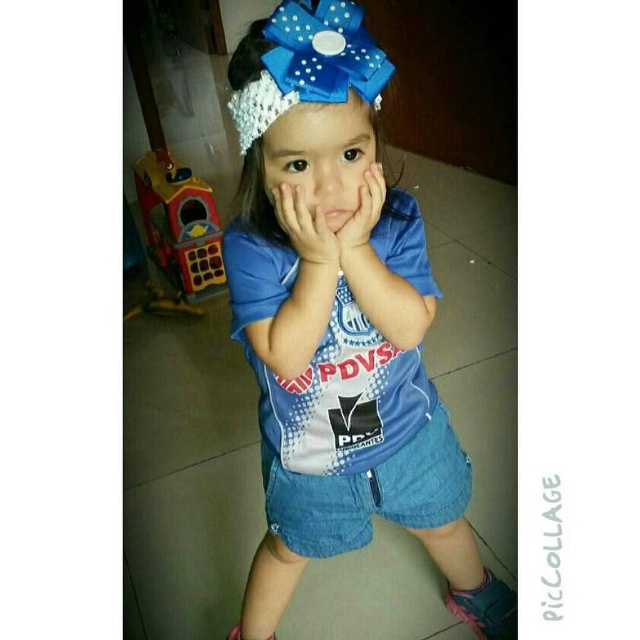
Question: Estimate the real-world distances between objects in this image. Which object is farther from the matte blue bow at center?

Choices:
 (A) matte plastic toy at left
 (B) matte blue hands at center
 (C) matte blue hand at center

Answer: (A)

Question: Does denim shorts at center lie behind matte blue hands at center?

Choices:
 (A) no
 (B) yes

Answer: (B)

Question: Can you confirm if matte blue bow at center is wider than matte blue hand at center?

Choices:
 (A) yes
 (B) no

Answer: (A)

Question: Which point is closer to the camera?

Choices:
 (A) (285, 465)
 (B) (276, 205)
 (C) (280, 524)
 (D) (280, 209)

Answer: (D)

Question: Does matte blue bow at center appear on the right side of matte plastic toy at left?

Choices:
 (A) no
 (B) yes

Answer: (B)

Question: Which point appears farthest from the camera in this image?

Choices:
 (A) (333, 186)
 (B) (378, 218)
 (C) (257, 168)
 (D) (182, 269)

Answer: (D)